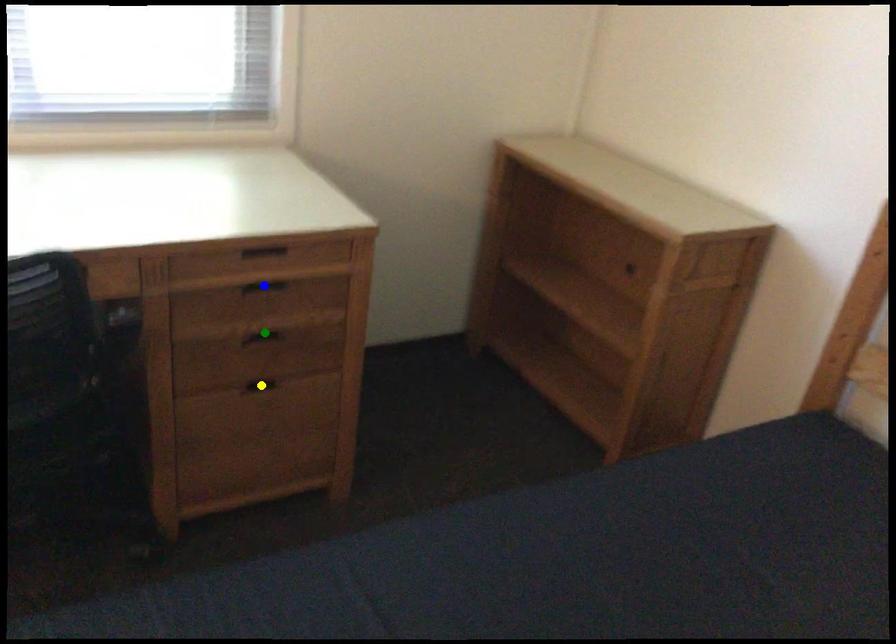
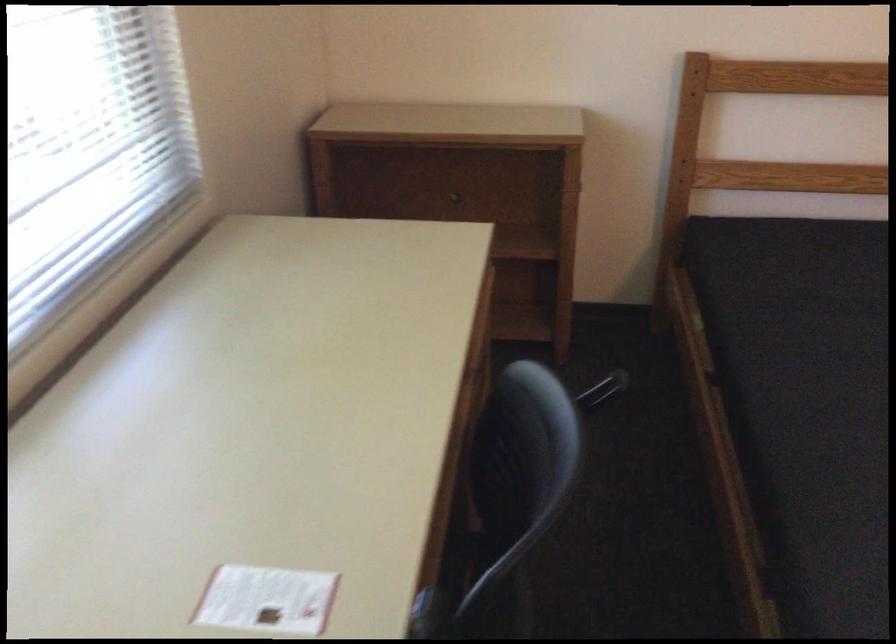
I am providing you with two images of the same scene from different viewpoints. Three points are marked in image1. Which point corresponds to a part or object that is occluded in image2?In image1, three points are marked. Which of them correspond to a part or object that is occluded in image2?Among the three points shown in image1, which one corresponds to a part or object that is no longer visible due to occlusion in image2?

green point, yellow point, blue point cannot be seen in image2.